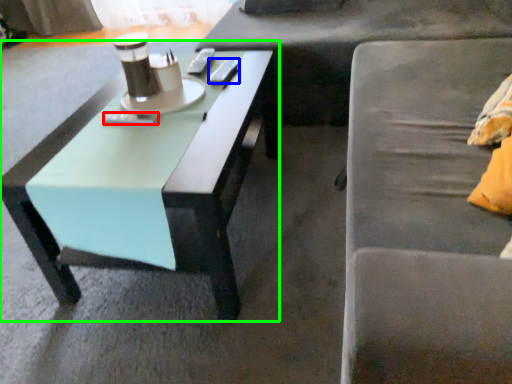
Question: Which object is the closest to the remote control (highlighted by a red box)? Choose among these: remote control (highlighted by a blue box) or coffee table (highlighted by a green box).

Choices:
 (A) remote control
 (B) coffee table

Answer: (B)